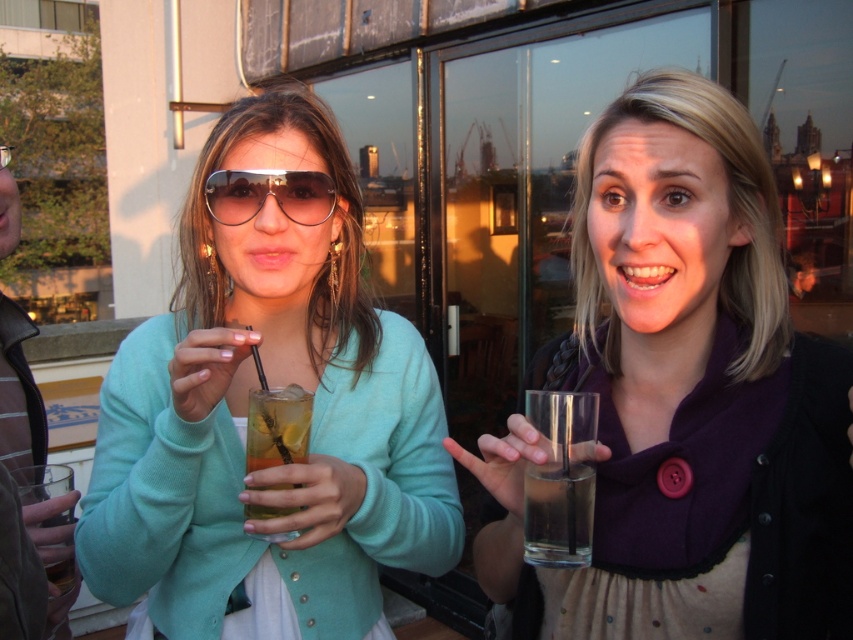
Which is in front, point (351, 417) or point (766, 317)?

Point (766, 317) is more forward.

Is matte teal sweater at center further to the viewer compared to matte black sweater at upper right?

That is False.

You are a GUI agent. You are given a task and a screenshot of the screen. Output one action in this format:
    pyautogui.click(x=<x>, y=<y>)
    Task: Click on the matte teal sweater at center
    This screenshot has width=853, height=640.
    Given the screenshot: What is the action you would take?
    pyautogui.click(x=247, y=412)

This screenshot has width=853, height=640. In order to click on matte teal sweater at center in this screenshot , I will do `click(247, 412)`.

Is clear glass water at center bigger than translucent glass drink at center?

Correct, clear glass water at center is larger in size than translucent glass drink at center.

Is clear glass water at center taller than translucent glass drink at center?

Yes, clear glass water at center is taller than translucent glass drink at center.

Does point (663, 140) come behind point (276, 509)?

No, (663, 140) is in front of (276, 509).

Where is `clear glass water at center`? clear glass water at center is located at coordinates (683, 396).

Between matte black sweater at upper right and metallic aviator sunglasses at center, which one is positioned higher?

metallic aviator sunglasses at center is above.

Is matte black sweater at upper right behind metallic aviator sunglasses at center?

No, it is not.

Is point (735, 368) less distant than point (329, 196)?

Yes, point (735, 368) is in front of point (329, 196).

This screenshot has height=640, width=853. In order to click on matte black sweater at upper right in this screenshot , I will do `click(730, 209)`.